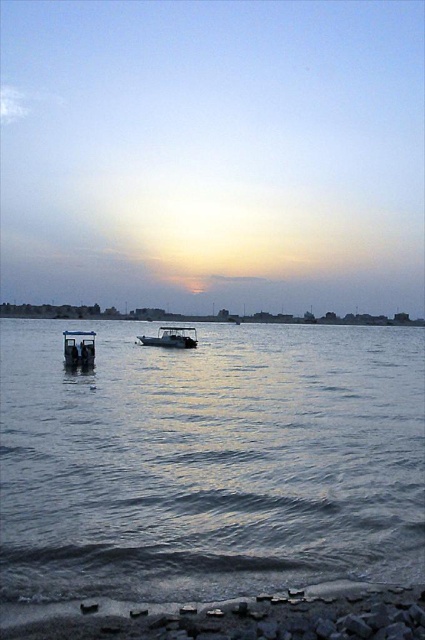
How distant is smooth sand beach at lower center from metallic gray boat at left?

smooth sand beach at lower center and metallic gray boat at left are 26.65 meters apart.

Who is lower down, smooth sand beach at lower center or metallic gray boat at left?

smooth sand beach at lower center is below.

Does point (325, 589) lie in front of point (84, 358)?

Yes, point (325, 589) is closer to viewer.

The height and width of the screenshot is (640, 425). I want to click on smooth sand beach at lower center, so click(232, 616).

Is clear water at center below smooth sand beach at lower center?

Incorrect, clear water at center is not positioned below smooth sand beach at lower center.

The height and width of the screenshot is (640, 425). Find the location of `clear water at center`. clear water at center is located at coordinates (209, 461).

Find the location of `clear water at center`. clear water at center is located at coordinates (209, 461).

Who is taller, metallic gray boat at left or metallic silver boat at center?

metallic gray boat at left

Does metallic gray boat at left come behind metallic silver boat at center?

No, it is not.

Is point (65, 333) behind point (166, 339)?

No.

You are a GUI agent. You are given a task and a screenshot of the screen. Output one action in this format:
    pyautogui.click(x=<x>, y=<y>)
    Task: Click on the metallic gray boat at left
    The image size is (425, 640).
    Given the screenshot: What is the action you would take?
    pyautogui.click(x=79, y=349)